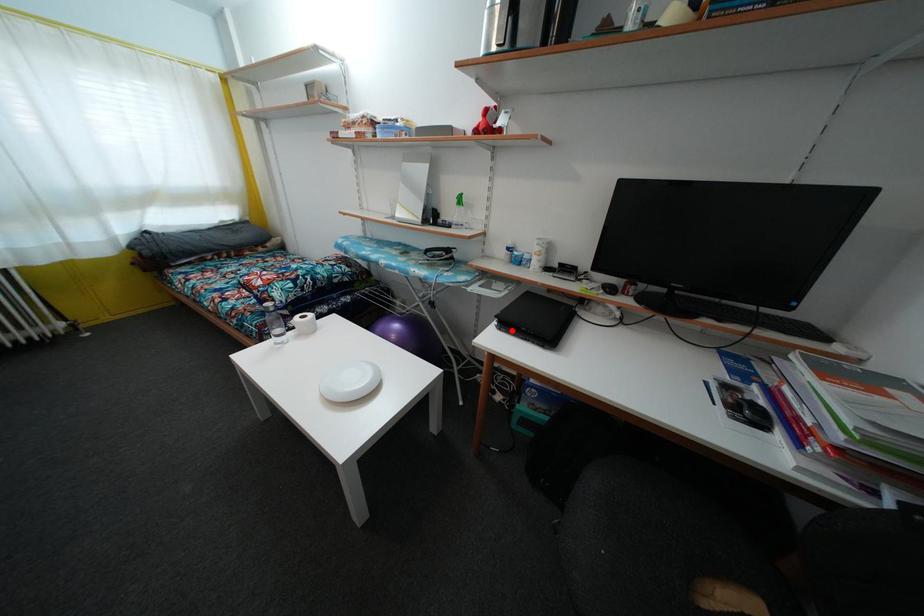
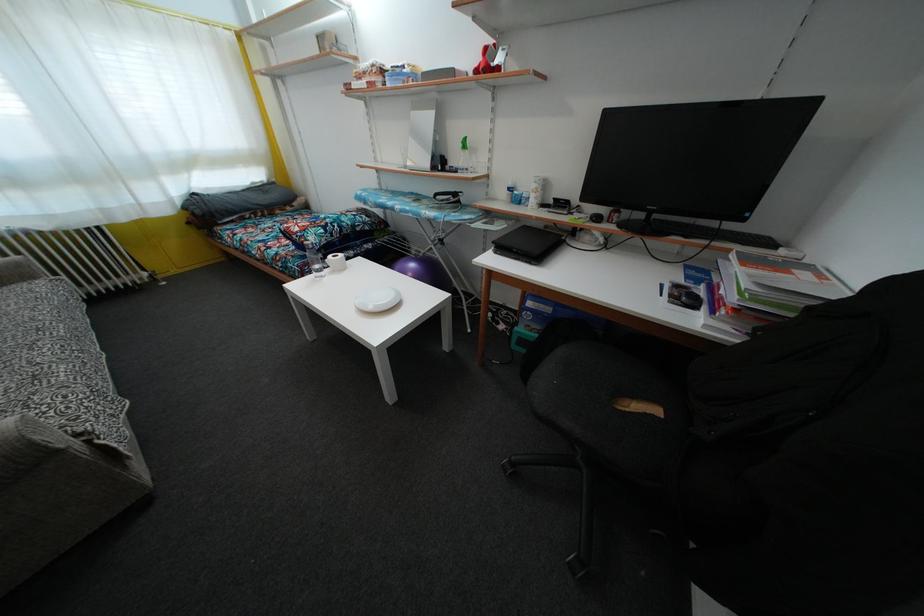
The point at the highlighted location is marked in the first image. Where is the corresponding point in the second image?

(506, 254)